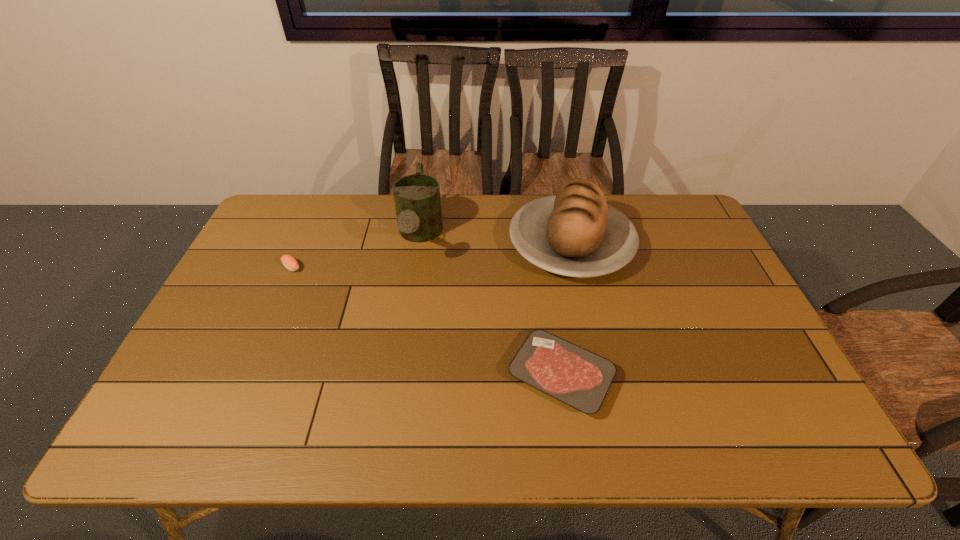
Where is `watering can`? watering can is located at coordinates (417, 200).

I want to click on bread, so click(x=575, y=233).

Where is `the leftmost object`? This screenshot has width=960, height=540. the leftmost object is located at coordinates (290, 263).

Identify the location of sushi. The width and height of the screenshot is (960, 540). (290, 263).

Locate an element on the screen. The height and width of the screenshot is (540, 960). the shortest object is located at coordinates (578, 377).

In order to click on steak in this screenshot , I will do `click(578, 377)`.

This screenshot has height=540, width=960. In order to click on vacant region located 0.150m with the spout on the watering can in this screenshot , I will do `click(408, 314)`.

The width and height of the screenshot is (960, 540). I want to click on vacant space located 0.090m on the right of the bread, so click(x=661, y=244).

Locate an element on the screen. This screenshot has height=540, width=960. vacant region located on the back of the third tallest object is located at coordinates (306, 231).

At what (x,y) coordinates should I click in order to perform the action: click on free spot located on the back of the steak. Please return your answer as a coordinate pair (x, y). This screenshot has width=960, height=540. Looking at the image, I should click on (549, 297).